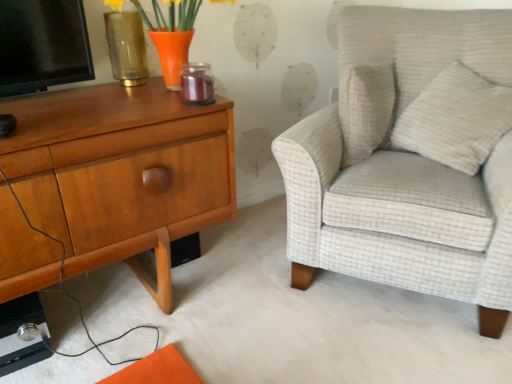
Question: Is white textured pillow at upper right completely or partially outside of light beige textured armchair at right?

Choices:
 (A) no
 (B) yes

Answer: (A)

Question: Does white textured pillow at upper right have a greater height compared to light beige textured armchair at right?

Choices:
 (A) yes
 (B) no

Answer: (B)

Question: From a real-world perspective, is white textured pillow at upper right below light beige textured armchair at right?

Choices:
 (A) no
 (B) yes

Answer: (A)

Question: Is white textured pillow at upper right further to the viewer compared to light beige textured armchair at right?

Choices:
 (A) yes
 (B) no

Answer: (A)

Question: Is white textured pillow at upper right to the right of light beige textured armchair at right from the viewer's perspective?

Choices:
 (A) yes
 (B) no

Answer: (A)

Question: Can you confirm if white textured pillow at upper right is positioned to the left of light beige textured armchair at right?

Choices:
 (A) yes
 (B) no

Answer: (B)

Question: Is light beige textured armchair at right at the left side of woodennightstand at left?

Choices:
 (A) no
 (B) yes

Answer: (A)

Question: From the image's perspective, does light beige textured armchair at right appear higher than woodennightstand at left?

Choices:
 (A) no
 (B) yes

Answer: (B)

Question: From a real-world perspective, is light beige textured armchair at right located beneath woodennightstand at left?

Choices:
 (A) yes
 (B) no

Answer: (B)

Question: Is light beige textured armchair at right positioned with its back to woodennightstand at left?

Choices:
 (A) no
 (B) yes

Answer: (A)

Question: Considering the relative sizes of light beige textured armchair at right and woodennightstand at left in the image provided, is light beige textured armchair at right taller than woodennightstand at left?

Choices:
 (A) no
 (B) yes

Answer: (B)

Question: Is light beige textured armchair at right completely or partially outside of woodennightstand at left?

Choices:
 (A) no
 (B) yes

Answer: (B)

Question: Is matte gold vase at upper left oriented towards orange glass vase at upper left?

Choices:
 (A) yes
 (B) no

Answer: (A)